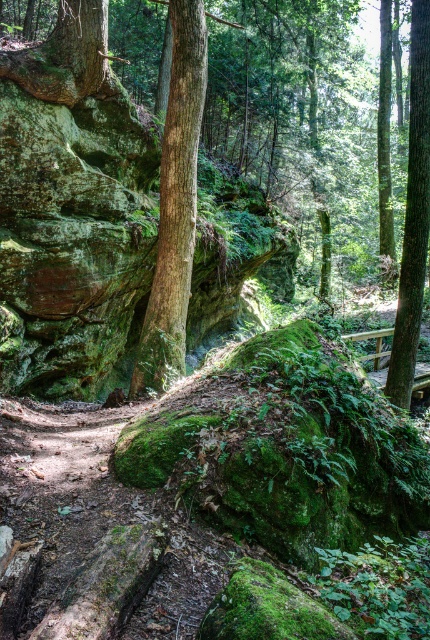
Who is higher up, green rough bark tree at center or green rough bark tree at right?

green rough bark tree at right is higher up.

Where is `green rough bark tree at center`? The height and width of the screenshot is (640, 430). green rough bark tree at center is located at coordinates (175, 205).

Is green mossy rock at center closer to the viewer compared to green rough bark tree at right?

Yes, green mossy rock at center is closer to the viewer.

Can you confirm if green mossy rock at center is shorter than green rough bark tree at right?

No.

Between point (77, 266) and point (427, 236), which one is positioned behind?

The point (427, 236) is behind.

This screenshot has width=430, height=640. What are the coordinates of `green mossy rock at center` in the screenshot? It's located at (108, 227).

Can you confirm if green mossy rock at center is positioned above green rough bark tree at center?

Yes, green mossy rock at center is above green rough bark tree at center.

Does green mossy rock at center appear on the right side of green rough bark tree at center?

Indeed, green mossy rock at center is positioned on the right side of green rough bark tree at center.

Identify the location of green mossy rock at center. (108, 227).